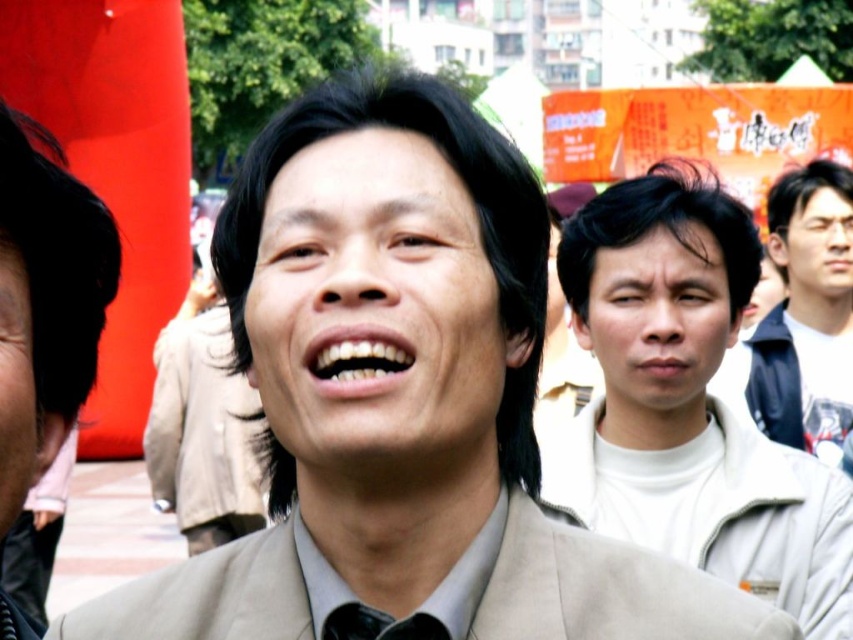
You are a photographer trying to capture a candid shot of the man in the beige fabric business suit at center and the smooth skin face at right. Since you want both subjects to be clearly visible in the frame, which subject should you focus on first to ensure proper focus and avoid blurriness?

The beige fabric business suit at center has a lesser height compared to the smooth skin face at right, so you should focus on the smooth skin face at right first because it is taller and more likely to be in focus when adjusting the camera settings.